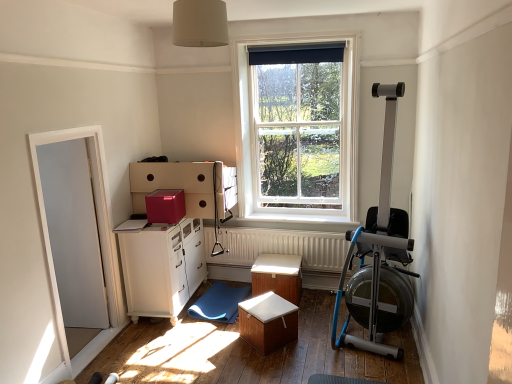
Find the location of a particular element. This screenshot has height=384, width=512. free region on the left part of wooden table at center, the first table positioned from the front is located at coordinates (222, 348).